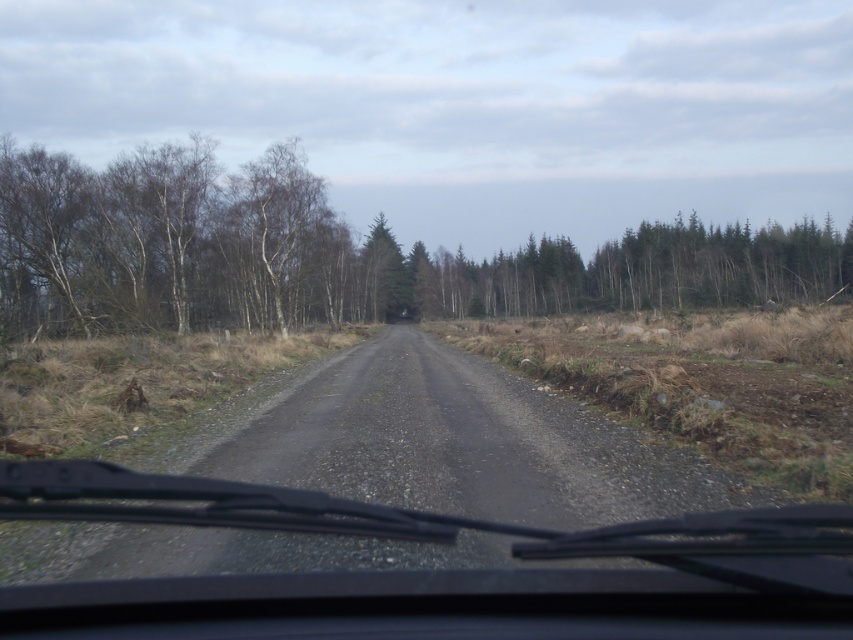
You are driving a car with a trunk that is 1.5 meters long. You see a point on the road ahead at coordinate point (35, 497). Can your trunk fit entirely behind this point without extending beyond it?

The point at (35, 497) is 5.21 meters away from you. Since your trunk is only 1.5 meters long, it will fit entirely behind the point as the distance is more than the trunk length.

You are driving on a rural road and see a point marked at coordinates (169,243). Based on the scene, what does this point indicate?

The point at (169,243) marks bare branches at left.

In the scene shown: You are driving a car and need to navigate around two points on the road ahead. The first point is at coordinates point (366, 616) and the second point is at point (392, 316). Based on the image, which point is closer to your current position in the driver seat?

Point (366, 616) is closer to the viewer than point (392, 316), so the first point is closer to your current position in the driver seat.